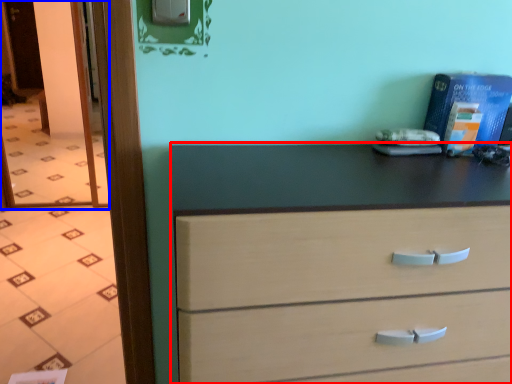
Question: Which point is further to the camera, chest of drawers (highlighted by a red box) or glass door (highlighted by a blue box)?

Choices:
 (A) chest of drawers
 (B) glass door

Answer: (B)